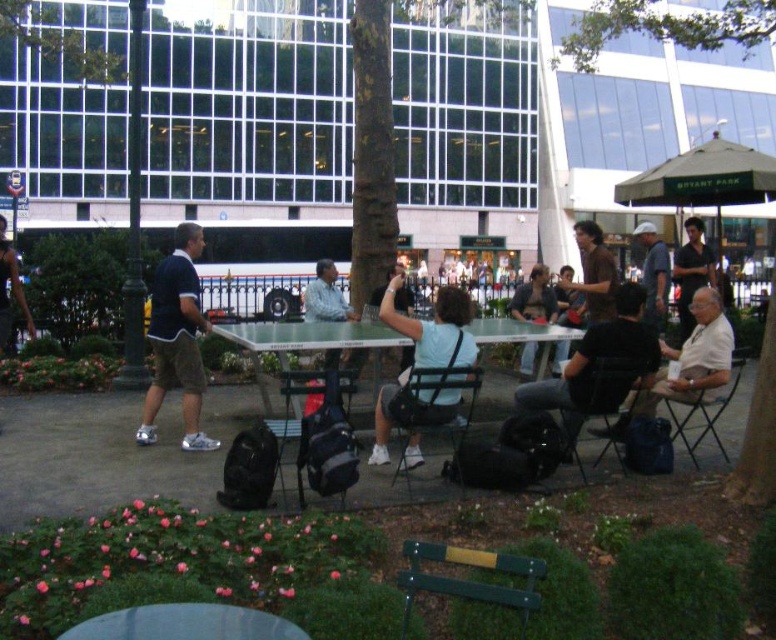
You are a photographer trying to capture a closeup shot of the dark brown hair at upper right and the dark brown leather jacket at center. Which object should you zoom in more on to ensure both fit in the frame?

Since the dark brown hair at upper right occupies less space than the dark brown leather jacket at center, you should zoom in more on the dark brown leather jacket at center to ensure both fit in the frame.

You are standing at the center of the park and want to locate the person with dark brown hair at upper right. Which direction should you look to find them?

The dark brown hair at upper right is located at point (x=691, y=273), so you should look towards the upper right direction to find them.

You are standing in the park and want to take a photo of the dark brown hair at upper right and the dark brown leather jacket at center. Which object should you focus on first to ensure it appears clearer in your photo?

The dark brown hair at upper right is closer to you than the dark brown leather jacket at center, so you should focus on the dark brown hair at upper right first to ensure it appears clearer in your photo.